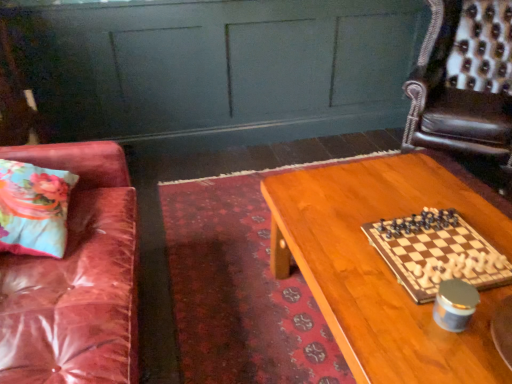
Image resolution: width=512 pixels, height=384 pixels. What are the coordinates of `empty space that is ontop of wooden chessboard at center (from a real-world perspective)` in the screenshot? It's located at (439, 254).